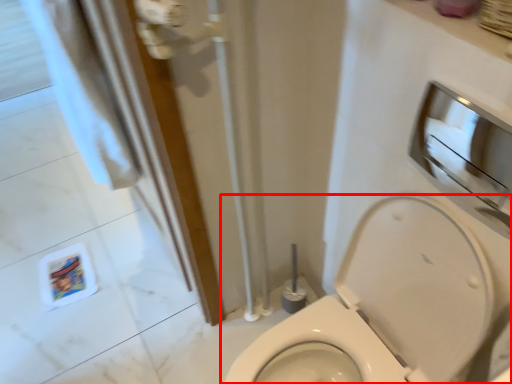
Question: From the image's perspective, where is toilet (annotated by the red box) located relative to medicine cabinet?

Choices:
 (A) below
 (B) above

Answer: (A)